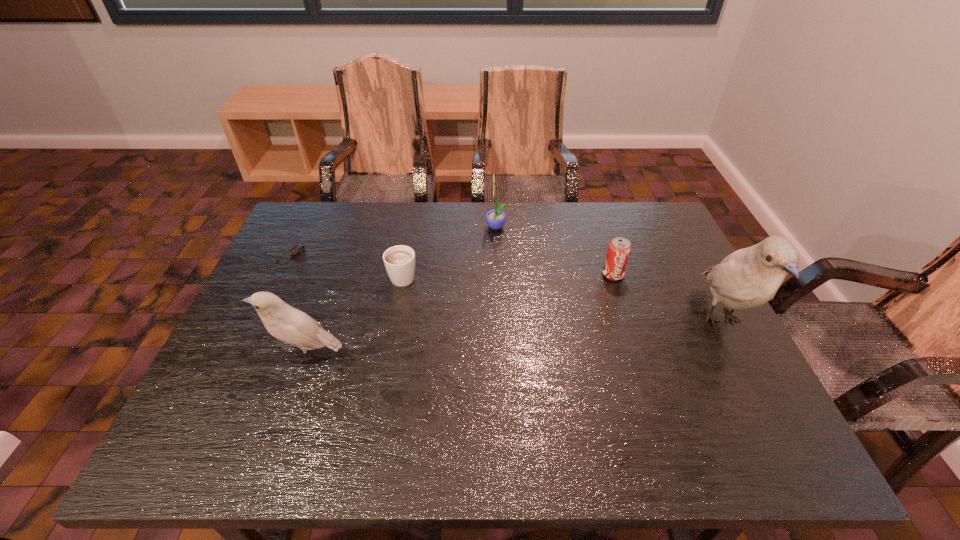
You are a GUI agent. You are given a task and a screenshot of the screen. Output one action in this format:
    pyautogui.click(x=<x>, y=<y>)
    Task: Click on the vacant region between the second object from left to right and the fourth tallest object
    The image size is (960, 540).
    Given the screenshot: What is the action you would take?
    pyautogui.click(x=460, y=314)

You are a GUI agent. You are given a task and a screenshot of the screen. Output one action in this format:
    pyautogui.click(x=<x>, y=<y>)
    Task: Click on the free spot between the cappuccino and the rightmost object
    This screenshot has height=540, width=960.
    Given the screenshot: What is the action you would take?
    pyautogui.click(x=562, y=298)

Where is `unoccupied area between the fifth tallest object and the left bird`? unoccupied area between the fifth tallest object and the left bird is located at coordinates (354, 314).

At what (x,y) coordinates should I click in order to perform the action: click on vacant area that lies between the left bird and the second shortest object. Please return your answer as a coordinate pair (x, y). This screenshot has width=960, height=540. Looking at the image, I should click on (354, 314).

The height and width of the screenshot is (540, 960). Find the location of `free space between the shorter bird and the second object from right to left`. free space between the shorter bird and the second object from right to left is located at coordinates (460, 314).

You are a GUI agent. You are given a task and a screenshot of the screen. Output one action in this format:
    pyautogui.click(x=<x>, y=<y>)
    Task: Click on the fourth closest object to the fifth object from right to left
    Image resolution: width=960 pixels, height=540 pixels.
    Given the screenshot: What is the action you would take?
    pyautogui.click(x=619, y=249)

Identify the location of the third closest object to the tallest object. Image resolution: width=960 pixels, height=540 pixels. (399, 261).

The height and width of the screenshot is (540, 960). In order to click on vacant space that satisfies the following two spatial constraints: 1. on the front side of the leftmost object; 2. on the right side of the soda can in this screenshot , I will do `click(280, 274)`.

At what (x,y) coordinates should I click in order to perform the action: click on free space that satisfies the following two spatial constraints: 1. with the handle on the side of the soda can; 2. on the left side of the fifth tallest object. Please return your answer as a coordinate pair (x, y). This screenshot has height=540, width=960. Looking at the image, I should click on (403, 274).

This screenshot has height=540, width=960. In order to click on vacant point that satisfies the following two spatial constraints: 1. on the front-facing side of the sunflower; 2. on the left side of the fifth object from left to right in this screenshot , I will do [x=497, y=274].